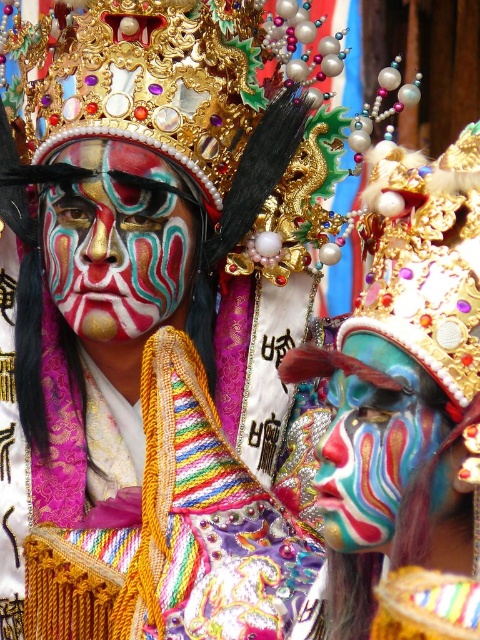
Question: Which point is farther to the camera?

Choices:
 (A) (381, 381)
 (B) (336, 400)
 (C) (106, 195)
 (D) (294, 88)

Answer: (D)

Question: Which point is farther to the camera?

Choices:
 (A) matte teal face paint at center
 (B) multicolored painted face at center
 (C) matte painted face at center
 (D) matte gold crown at upper center

Answer: (C)

Question: Considering the real-world distances, which object is closest to the matte painted face at center?

Choices:
 (A) multicolored painted face at center
 (B) matte teal face paint at center
 (C) matte gold crown at upper center

Answer: (C)

Question: Is the position of matte teal face paint at center less distant than that of multicolored painted face at center?

Choices:
 (A) no
 (B) yes

Answer: (B)

Question: Is matte gold crown at upper center positioned behind matte teal face paint at center?

Choices:
 (A) yes
 (B) no

Answer: (A)

Question: Does matte painted face at center appear over multicolored painted face at center?

Choices:
 (A) no
 (B) yes

Answer: (B)